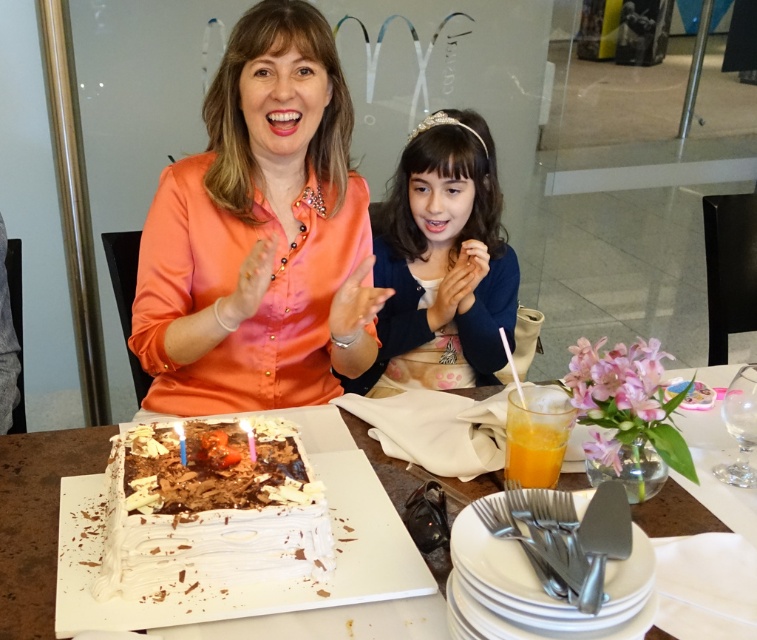
Question: Which of these objects is positioned closest to the translucent glass cup at lower right?

Choices:
 (A) matte blue sweater at center
 (B) white chocolate cake at center
 (C) orange satin blouse at upper left

Answer: (B)

Question: Considering the real-world distances, which object is farthest from the white frosted cake at center?

Choices:
 (A) white chocolate cake at center
 (B) orange satin blouse at upper left

Answer: (B)

Question: Can you confirm if white chocolate cake at center is positioned above white frosted cake at center?

Choices:
 (A) yes
 (B) no

Answer: (B)

Question: Which is nearer to the white chocolate cake at center?

Choices:
 (A) matte blue sweater at center
 (B) orange satin blouse at upper left

Answer: (B)

Question: Observing the image, what is the correct spatial positioning of white chocolate cake at center in reference to translucent glass cup at lower right?

Choices:
 (A) above
 (B) below

Answer: (B)

Question: Can you confirm if orange satin blouse at upper left is wider than translucent glass cup at lower right?

Choices:
 (A) yes
 (B) no

Answer: (A)